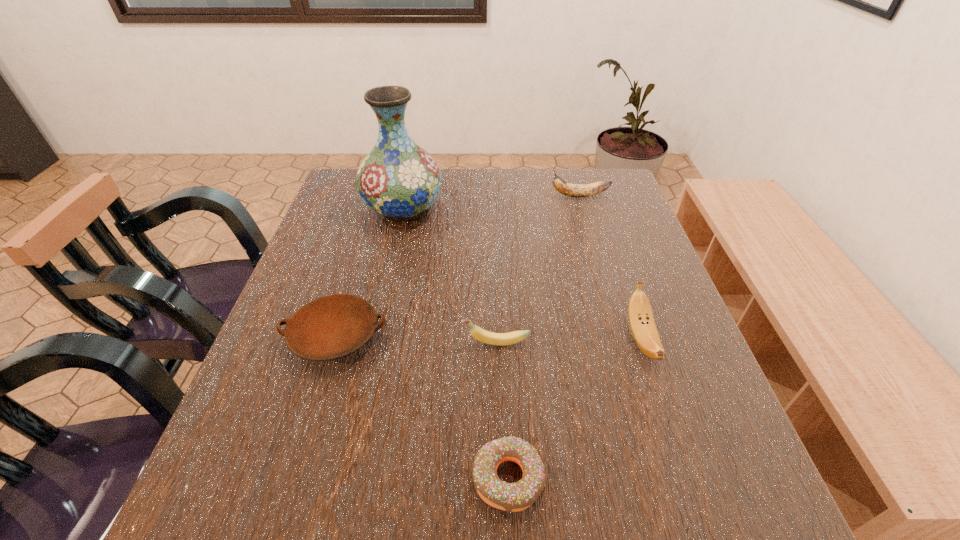
Where is `object that is at the far left corner`? object that is at the far left corner is located at coordinates (398, 179).

You are a GUI agent. You are given a task and a screenshot of the screen. Output one action in this format:
    pyautogui.click(x=<x>, y=<y>)
    Task: Click on the object present at the far right corner
    
    Given the screenshot: What is the action you would take?
    pyautogui.click(x=573, y=190)

Identify the location of vacant space at the far edge. (457, 186).

In the image, there is a desktop. At what (x,y) coordinates should I click in order to perform the action: click on vacant space at the near edge. Please return your answer as a coordinate pair (x, y). Looking at the image, I should click on (615, 499).

Find the location of `vacant space at the left edge`. vacant space at the left edge is located at coordinates (240, 401).

In the image, there is a desktop. At what (x,y) coordinates should I click in order to perform the action: click on vacant space at the right edge. Please return your answer as a coordinate pair (x, y). Image resolution: width=960 pixels, height=540 pixels. Looking at the image, I should click on (614, 292).

The height and width of the screenshot is (540, 960). In the image, there is a desktop. Identify the location of vacant space at the far right corner. (629, 199).

At what (x,y) coordinates should I click in order to perform the action: click on free space between the vase and the farthest banana. Please return your answer as a coordinate pair (x, y). Looking at the image, I should click on (492, 202).

Find the location of `vacant space in between the third shortest object and the plate`. vacant space in between the third shortest object and the plate is located at coordinates (416, 339).

You are a GUI agent. You are given a task and a screenshot of the screen. Output one action in this format:
    pyautogui.click(x=<x>, y=<y>)
    Task: Click on the free area in between the vase and the leftmost banana
    The width and height of the screenshot is (960, 540).
    Given the screenshot: What is the action you would take?
    pyautogui.click(x=449, y=275)